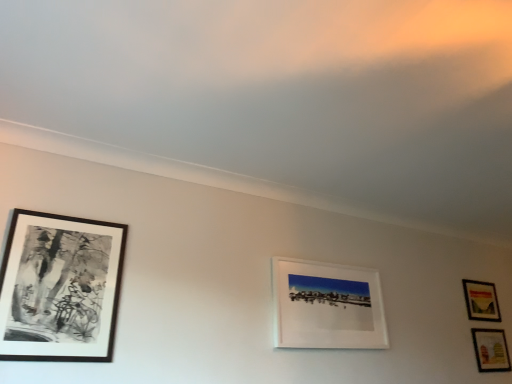
Question: Is white matte picture frame at center, which ranks as the 2th picture frame in front-to-back order, thinner than black matte picture frame at left, the 4th picture frame viewed from the right?

Choices:
 (A) yes
 (B) no

Answer: (A)

Question: Can you confirm if white matte picture frame at center, which is the 3th picture frame from right to left, is wider than black matte picture frame at left, which is the fourth picture frame in back-to-front order?

Choices:
 (A) yes
 (B) no

Answer: (B)

Question: Is white matte picture frame at center, which is the second picture frame in left-to-right order, positioned behind black matte picture frame at left, positioned as the 1th picture frame in front-to-back order?

Choices:
 (A) yes
 (B) no

Answer: (A)

Question: From the image's perspective, is white matte picture frame at center, arranged as the third picture frame when viewed from the back, located above black matte picture frame at left, the 4th picture frame viewed from the right?

Choices:
 (A) no
 (B) yes

Answer: (A)

Question: Is white matte picture frame at center, which is the 3th picture frame from right to left, oriented towards black matte picture frame at left, positioned as the 1th picture frame in front-to-back order?

Choices:
 (A) no
 (B) yes

Answer: (A)

Question: Does white matte picture frame at center, which ranks as the 2th picture frame in front-to-back order, appear on the right side of black matte picture frame at left, the 4th picture frame viewed from the right?

Choices:
 (A) no
 (B) yes

Answer: (B)

Question: From a real-world perspective, is white matte picture frame at center, which is the 3th picture frame from right to left, over matte wooden picture frame at lower right, which is counted as the second picture frame, starting from the back?

Choices:
 (A) no
 (B) yes

Answer: (B)

Question: Is white matte picture frame at center, arranged as the third picture frame when viewed from the back, behind matte wooden picture frame at lower right, which is counted as the second picture frame, starting from the back?

Choices:
 (A) no
 (B) yes

Answer: (A)

Question: From a real-world perspective, is white matte picture frame at center, which is the second picture frame in left-to-right order, beneath matte wooden picture frame at lower right, arranged as the 4th picture frame when viewed from the left?

Choices:
 (A) no
 (B) yes

Answer: (A)

Question: Is there a large distance between white matte picture frame at center, arranged as the third picture frame when viewed from the back, and matte wooden picture frame at lower right, marked as the 1th picture frame in a right-to-left arrangement?

Choices:
 (A) no
 (B) yes

Answer: (B)

Question: Can matte wooden picture frame at lower right, marked as the third picture frame in a front-to-back arrangement, be found inside white matte picture frame at center, which ranks as the 2th picture frame in front-to-back order?

Choices:
 (A) yes
 (B) no

Answer: (B)

Question: Does white matte picture frame at center, arranged as the third picture frame when viewed from the back, appear on the left side of matte wooden picture frame at lower right, which is counted as the second picture frame, starting from the back?

Choices:
 (A) no
 (B) yes

Answer: (B)

Question: Is black matte picture frame at left, the 4th picture frame viewed from the right, not inside matte wooden picture frame at lower right, marked as the third picture frame in a front-to-back arrangement?

Choices:
 (A) yes
 (B) no

Answer: (A)